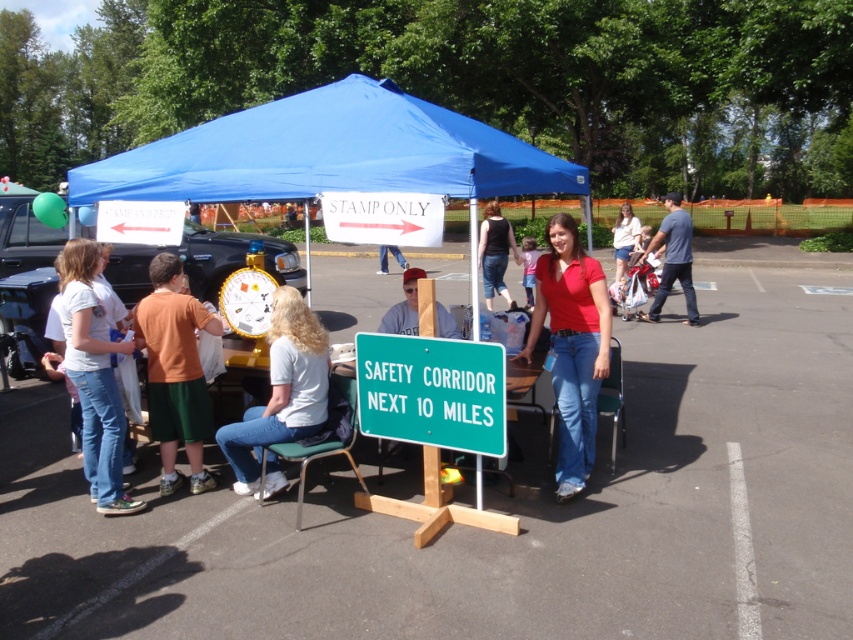
You are attending an outdoor event and see two people wearing the red cotton shirt at center and the light pink fabric shirt at center. Which person is closer to you?

The red cotton shirt at center is closer to you because it is in front of the light pink fabric shirt at center.

You are a photographer at the event and need to capture both the red cotton shirt at center and the light pink fabric shirt at center in a single shot. Based on their positions, which shirt should you focus on first to ensure both are in frame?

The red cotton shirt at center is located below the light pink fabric shirt at center, so focusing on the light pink fabric shirt at center first will ensure both are within the frame since it is positioned higher up.